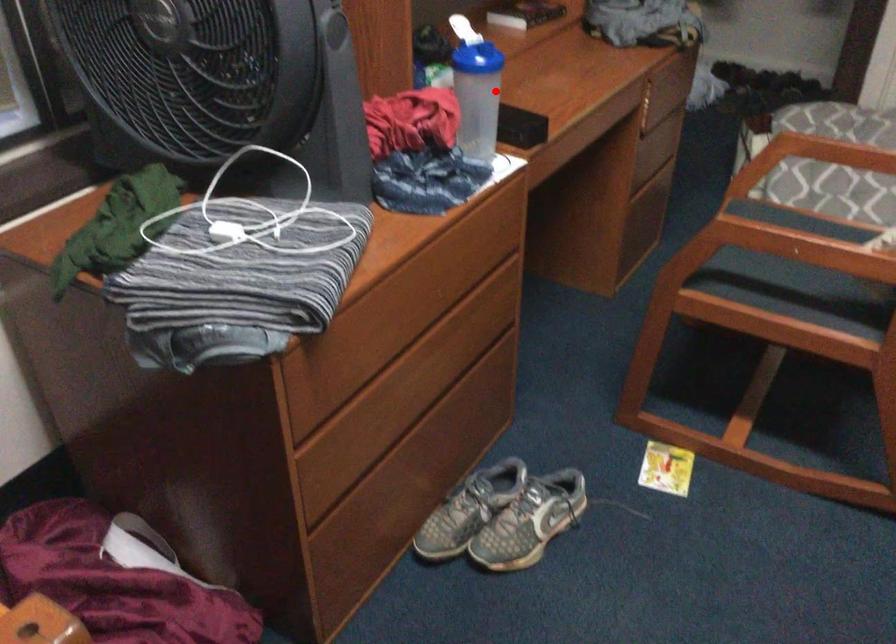
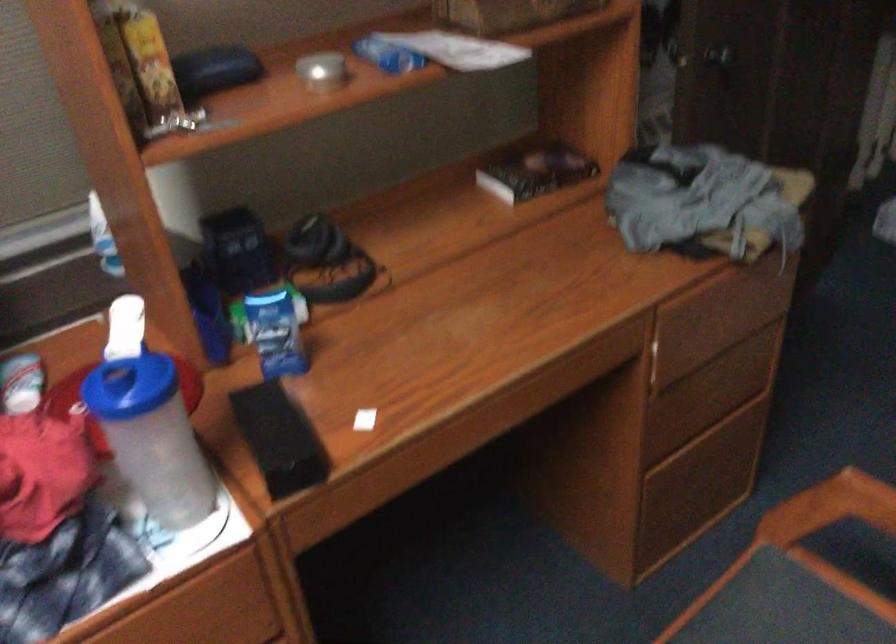
Question: I am providing you with two images of the same scene from different viewpoints. Given a red point in image1, look at the same physical point in image2. Is it:

Choices:
 (A) Closer to the viewpoint
 (B) Farther from the viewpoint

Answer: (A)